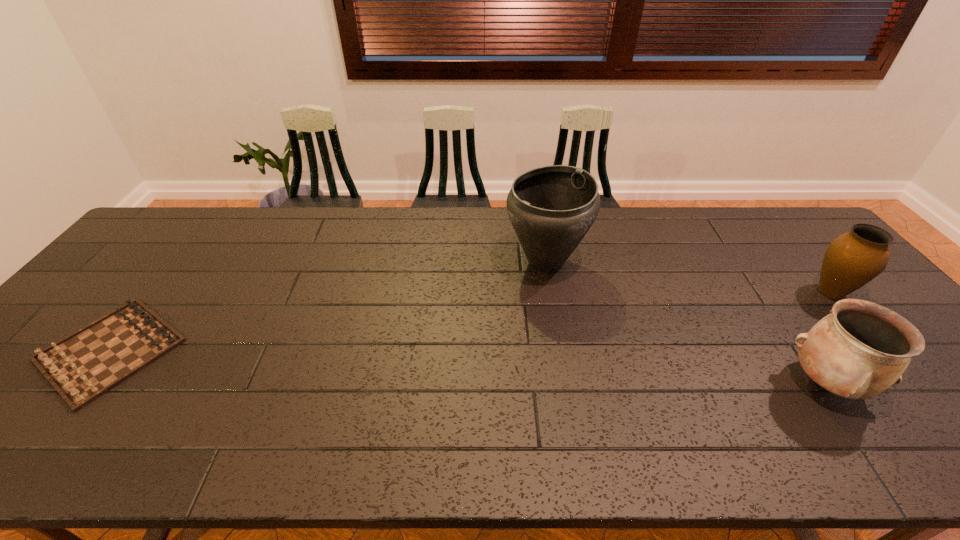
Locate an element on the screen. The image size is (960, 540). free region that satisfies the following two spatial constraints: 1. on the back side of the rightmost urn; 2. on the right side of the second urn from left to right is located at coordinates (764, 292).

This screenshot has height=540, width=960. Identify the location of vacant area in the image that satisfies the following two spatial constraints: 1. on the back side of the rightmost object; 2. on the right side of the third object from left to right. (764, 292).